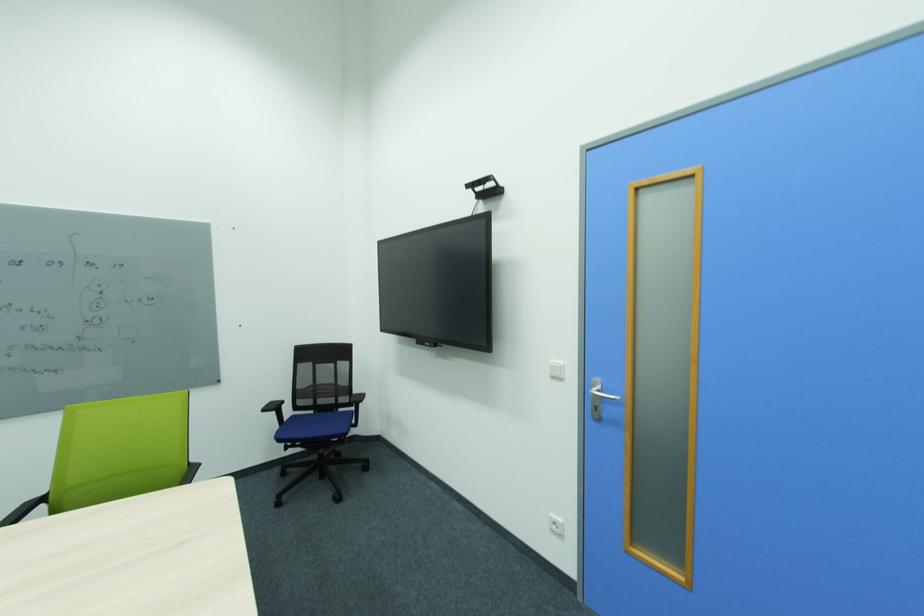
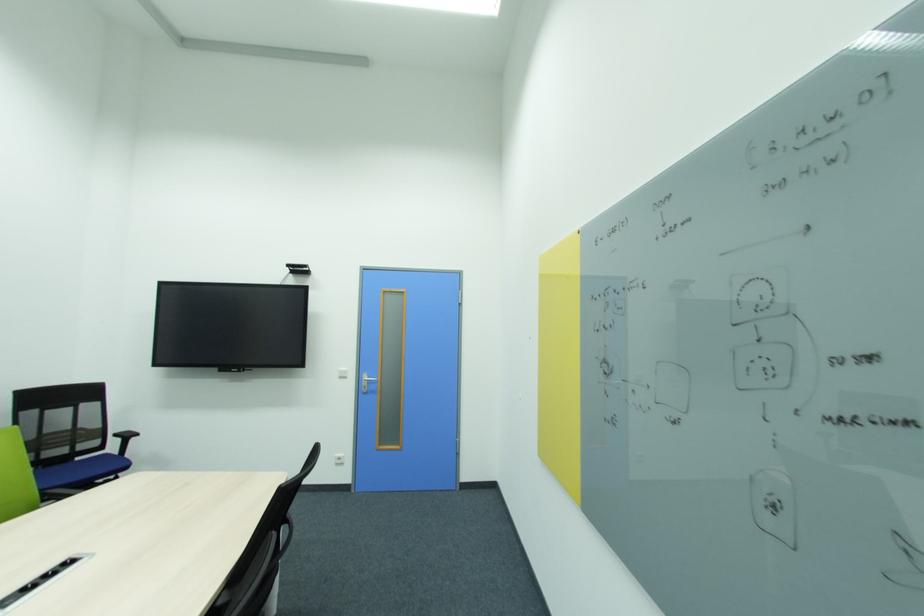
Locate, in the second image, the point that corresponds to the point at 345,411 in the first image.

(82, 460)